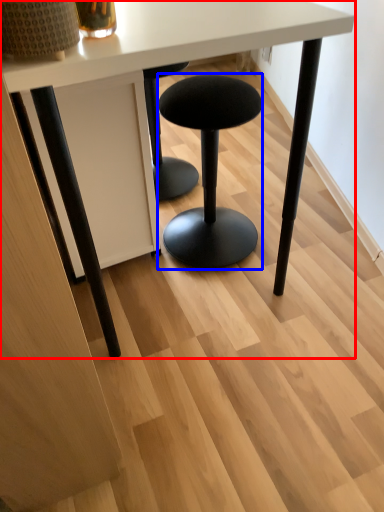
Question: Which of the following is the farthest to the observer, table (highlighted by a red box) or stool (highlighted by a blue box)?

Choices:
 (A) table
 (B) stool

Answer: (B)